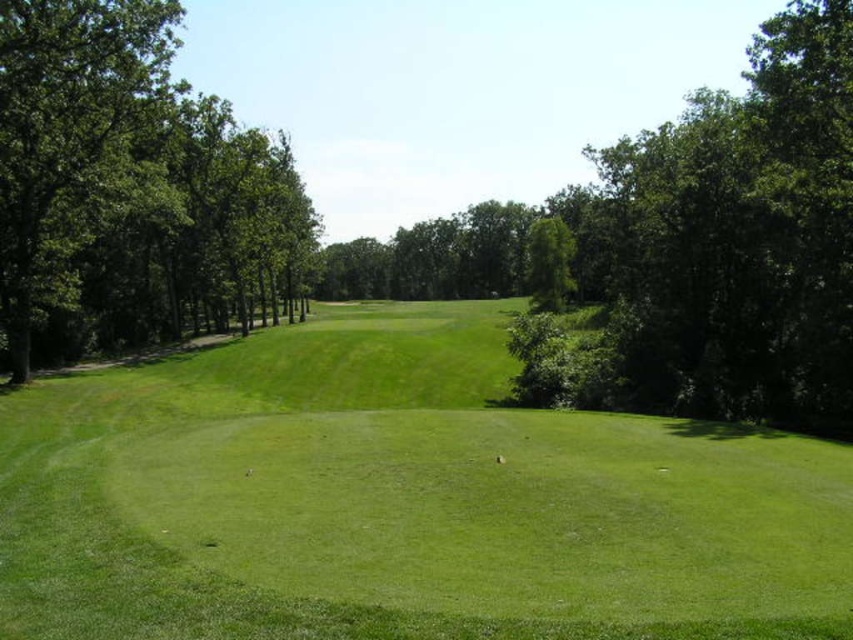
Can you confirm if green grassy golf course at center is positioned above green leafy trees at left?

Incorrect, green grassy golf course at center is not positioned above green leafy trees at left.

Which is in front, point (221, 632) or point (219, 316)?

Point (221, 632) is more forward.

Is point (607, 538) positioned in front of point (112, 282)?

Yes, point (607, 538) is closer to viewer.

Identify the location of green grassy golf course at center. (401, 500).